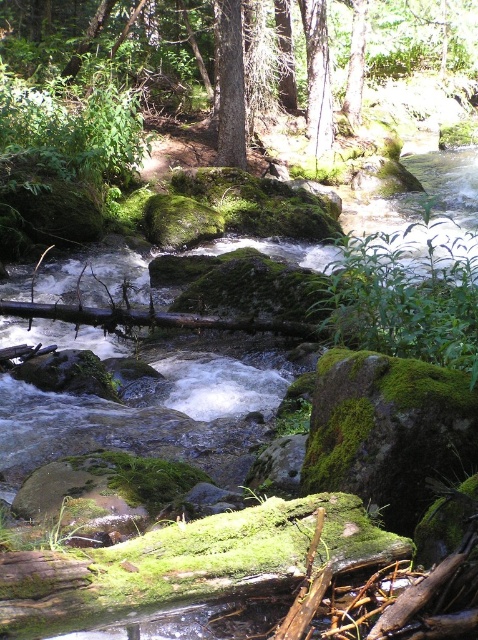
You are a hiker carrying a 15 feet long rope. You need to cross the stream between the green mossy rock at center and the green matte tree at center. Can you use the rope to bridge the gap?

The distance between the green mossy rock at center and the green matte tree at center is 18.13 feet. Since the rope is only 15 feet long, it is not long enough to bridge the gap.

You are a hiker trying to cross the stream. You see a green mossy rock at center and a green matte tree at center. Which object should you step on first to reach the other side?

You should step on the green mossy rock at center first because it is positioned to the right of the green matte tree at center, making it closer to your starting point on the left side of the stream.